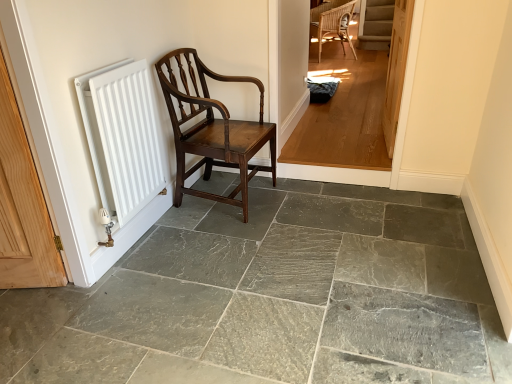
In order to face white matte radiator at left, should I rotate leftwards or rightwards?

You should look left and rotate roughly 17.165 degrees.

Measure the distance between white matte radiator at left and camera.

A distance of 1.66 meters exists between white matte radiator at left and camera.

What do you see at coordinates (396, 70) in the screenshot?
I see `light brown wooden door at center` at bounding box center [396, 70].

The height and width of the screenshot is (384, 512). Find the location of `polished dark wood chair at left`. polished dark wood chair at left is located at coordinates (212, 129).

Image resolution: width=512 pixels, height=384 pixels. I want to click on light brown wood floor at center, so click(351, 101).

Measure the distance between gray slate floor at center and camera.

The distance of gray slate floor at center from camera is 4.83 feet.

Where is `white matte radiator at left`? This screenshot has width=512, height=384. white matte radiator at left is located at coordinates (122, 136).

Find the location of `chair above the gray slate floor at center (from a real-world perspective)`. chair above the gray slate floor at center (from a real-world perspective) is located at coordinates (212, 129).

Is gray slate floor at center oriented towards polished dark wood chair at left?

No, gray slate floor at center is not oriented towards polished dark wood chair at left.

How different are the orientations of gray slate floor at center and polished dark wood chair at left in degrees?

There is a 86.8-degree angle between the facing directions of gray slate floor at center and polished dark wood chair at left.

Does point (476, 288) come farther from viewer compared to point (226, 201)?

No, (476, 288) is closer to viewer.

From a real-world perspective, is white matte radiator at left positioned above or below gray slate floor at center?

In terms of real-world spatial position, white matte radiator at left is above gray slate floor at center.

Are white matte radiator at left and gray slate floor at center located far from each other?

white matte radiator at left is actually quite close to gray slate floor at center.

Considering the relative sizes of white matte radiator at left and gray slate floor at center in the image provided, is white matte radiator at left taller than gray slate floor at center?

Yes.

Between point (121, 192) and point (338, 198), which one is positioned behind?

Positioned behind is point (338, 198).

What's the angular difference between white matte radiator at left and light brown wood floor at center's facing directions?

They differ by 89.8 degrees in their facing directions.

Which is further, (95, 114) or (339, 149)?

The point (339, 149) is farther from the camera.

Which is correct: white matte radiator at left is inside light brown wood floor at center, or outside of it?

The correct answer is: outside.

Is white matte radiator at left in front of or behind light brown wood floor at center in the image?

Visually, white matte radiator at left is located in front of light brown wood floor at center.

Does light brown wood floor at center touch gray slate floor at center?

There is a gap between light brown wood floor at center and gray slate floor at center.

Based on the photo, in terms of width, does light brown wood floor at center look wider or thinner when compared to gray slate floor at center?

Clearly, light brown wood floor at center has less width compared to gray slate floor at center.

Identify the location of limestone below the light brown wood floor at center (from a real-world perspective). (304, 290).

How many degrees apart are the facing directions of light brown wood floor at center and gray slate floor at center?

They differ by 1.43 degrees in their facing directions.

How different are the orientations of polished dark wood chair at left and gray slate floor at center in degrees?

The facing directions of polished dark wood chair at left and gray slate floor at center are 86.8 degrees apart.

This screenshot has height=384, width=512. I want to click on chair behind the gray slate floor at center, so click(212, 129).

Is polished dark wood chair at left turned away from gray slate floor at center?

No, polished dark wood chair at left's orientation is not away from gray slate floor at center.

Does polished dark wood chair at left come in front of gray slate floor at center?

No, polished dark wood chair at left is further to the viewer.

Is white matte radiator at left aimed at polished dark wood chair at left?

No, white matte radiator at left is not turned towards polished dark wood chair at left.

Do you think white matte radiator at left is within polished dark wood chair at left, or outside of it?

white matte radiator at left cannot be found inside polished dark wood chair at left.

Is white matte radiator at left touching polished dark wood chair at left?

There is a gap between white matte radiator at left and polished dark wood chair at left.

Locate an element on the screen. radiator that appears below the polished dark wood chair at left (from the image's perspective) is located at coordinates (122, 136).

Choose the correct answer: Is polished dark wood chair at left inside light brown wood floor at center or outside it?

The correct answer is: outside.

Is polished dark wood chair at left to the right of light brown wood floor at center from the viewer's perspective?

No, polished dark wood chair at left is not to the right of light brown wood floor at center.

How distant is polished dark wood chair at left from light brown wood floor at center?

A distance of 35.78 inches exists between polished dark wood chair at left and light brown wood floor at center.

Is point (162, 66) closer to camera compared to point (392, 92)?

Yes, it is.

Where is `limestone that is on the right side of polished dark wood chair at left`? limestone that is on the right side of polished dark wood chair at left is located at coordinates (304, 290).

The image size is (512, 384). Find the location of `radiator above the gray slate floor at center (from the image's perspective)`. radiator above the gray slate floor at center (from the image's perspective) is located at coordinates (122, 136).

Considering their positions, is light brown wooden door at center positioned further to gray slate floor at center than light brown wood floor at center?

light brown wood floor at center lies further to gray slate floor at center than the other object.

Looking at this image, based on their spatial positions, is gray slate floor at center or light brown wood floor at center closer to polished dark wood chair at left?

gray slate floor at center is positioned closer to the anchor polished dark wood chair at left.

Based on the photo, from the image, which object appears to be farther from gray slate floor at center, light brown wood floor at center or polished dark wood chair at left?

Based on the image, light brown wood floor at center appears to be further to gray slate floor at center.

Looking at the image, which one is located closer to gray slate floor at center, light brown wooden door at center or polished dark wood chair at left?

polished dark wood chair at left is positioned closer to the anchor gray slate floor at center.

Estimate the real-world distances between objects in this image. Which object is further from white matte radiator at left, light brown wood floor at center or polished dark wood chair at left?

light brown wood floor at center lies further to white matte radiator at left than the other object.

From the image, which object appears to be nearer to light brown wood floor at center, light brown wooden door at center or white matte radiator at left?

light brown wooden door at center is positioned closer to the anchor light brown wood floor at center.

Considering their positions, is gray slate floor at center positioned closer to light brown wooden door at center than white matte radiator at left?

gray slate floor at center lies closer to light brown wooden door at center than the other object.

Looking at the image, which one is located closer to polished dark wood chair at left, light brown wood floor at center or gray slate floor at center?

Among the two, gray slate floor at center is located nearer to polished dark wood chair at left.

Identify the location of chair between gray slate floor at center and light brown wood floor at center along the z-axis. The width and height of the screenshot is (512, 384). (212, 129).

You are a GUI agent. You are given a task and a screenshot of the screen. Output one action in this format:
    pyautogui.click(x=<x>, y=<y>)
    Task: Click on the chair located between white matte radiator at left and light brown wood floor at center in the left-right direction
    
    Given the screenshot: What is the action you would take?
    pyautogui.click(x=212, y=129)

You are a GUI agent. You are given a task and a screenshot of the screen. Output one action in this format:
    pyautogui.click(x=<x>, y=<y>)
    Task: Click on the chair located between gray slate floor at center and light brown wooden door at center in the depth direction
    This screenshot has width=512, height=384.
    Given the screenshot: What is the action you would take?
    pyautogui.click(x=212, y=129)

Identify the location of limestone between white matte radiator at left and light brown wooden door at center. (304, 290).